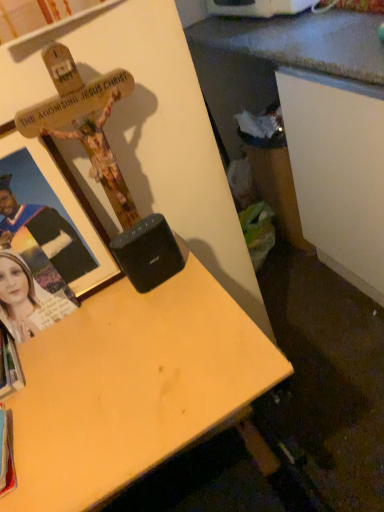
You are a GUI agent. You are given a task and a screenshot of the screen. Output one action in this format:
    pyautogui.click(x=<x>, y=<y>)
    Task: Click on the unoccupied area in front of black plastic speaker at center
    
    Given the screenshot: What is the action you would take?
    pyautogui.click(x=169, y=331)